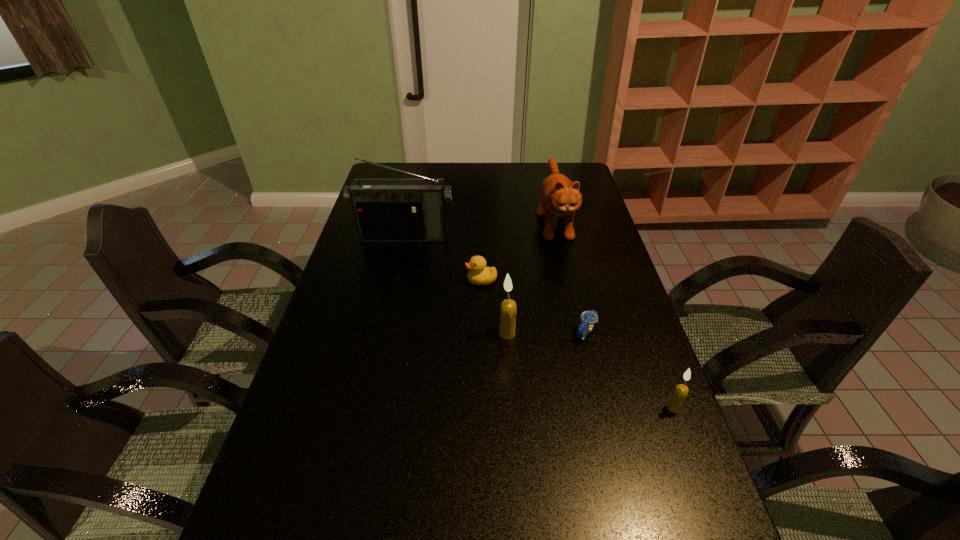
Locate an element on the screen. vacant area situated on the back of the left candle is located at coordinates (505, 293).

The image size is (960, 540). Identify the location of vacant area located 0.110m on the front of the shorter candle. (693, 458).

Where is `vacant space situated 0.380m on the face of the cat`? The width and height of the screenshot is (960, 540). vacant space situated 0.380m on the face of the cat is located at coordinates (581, 335).

In order to click on free space located on the front-facing side of the tallest object in this screenshot , I will do [x=388, y=314].

Identify the location of free space located on the face of the fourth nearest object. (379, 280).

Locate an element on the screen. vacant region located on the face of the fourth nearest object is located at coordinates (420, 280).

Identify the location of vacant space located on the face of the fourth nearest object. (434, 280).

Identify the location of vacant space located 0.200m on the left of the shortest object. Image resolution: width=960 pixels, height=540 pixels. (501, 333).

Find the location of `object that is at the left edge`. object that is at the left edge is located at coordinates (386, 210).

Locate an element on the screen. candle situated at the right edge is located at coordinates (676, 401).